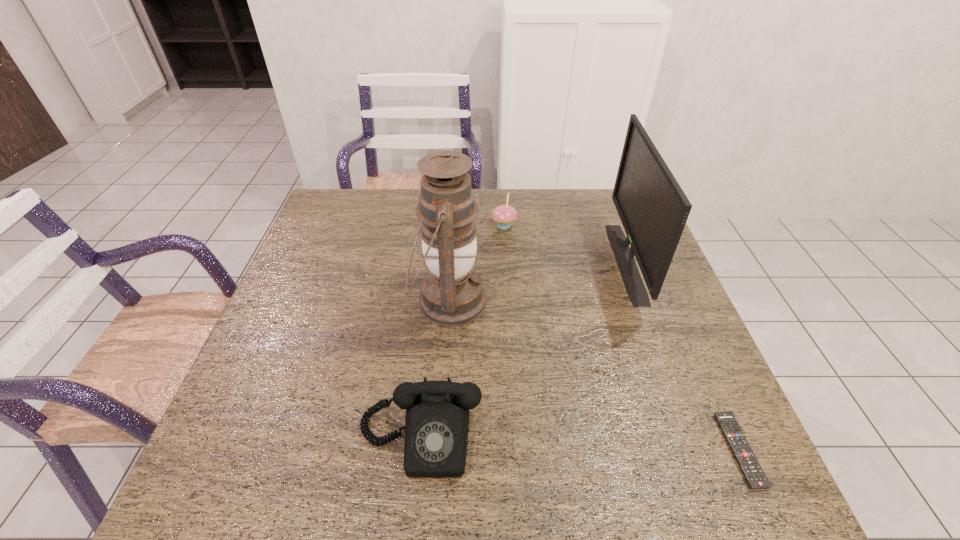
The width and height of the screenshot is (960, 540). I want to click on object located in the near right corner section of the desktop, so click(x=745, y=457).

Image resolution: width=960 pixels, height=540 pixels. I want to click on vacant space at the far edge, so click(557, 226).

This screenshot has height=540, width=960. In order to click on free location at the near edge in this screenshot , I will do `click(480, 504)`.

Find the location of a particular element. The height and width of the screenshot is (540, 960). vacant space at the left edge of the desktop is located at coordinates (300, 294).

Where is `vacant region at the right edge of the desktop`? vacant region at the right edge of the desktop is located at coordinates (684, 380).

Find the location of a particular element. The image size is (960, 540). free location at the far right corner of the desktop is located at coordinates (602, 223).

At what (x,y) coordinates should I click in order to perform the action: click on vacant point located between the telephone and the rightmost object. Please return your answer as a coordinate pair (x, y). Looking at the image, I should click on point(580,444).

This screenshot has width=960, height=540. In order to click on free spot between the cupcake and the rightmost object in this screenshot , I will do `click(622, 338)`.

Find the location of `vacant area between the tallest object and the telephone`. vacant area between the tallest object and the telephone is located at coordinates (434, 370).

Identify the location of unoccupied area between the telephone and the second tallest object. (523, 350).